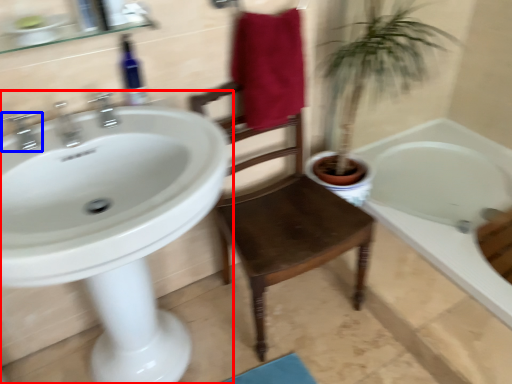
Question: Which point is closer to the camera, sink (highlighted by a red box) or tap (highlighted by a blue box)?

Choices:
 (A) sink
 (B) tap

Answer: (A)